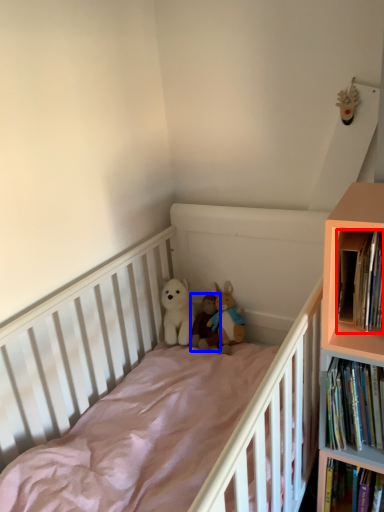
Question: Which object appears farthest to the camera in this image, book (highlighted by a red box) or toy (highlighted by a blue box)?

Choices:
 (A) book
 (B) toy

Answer: (B)